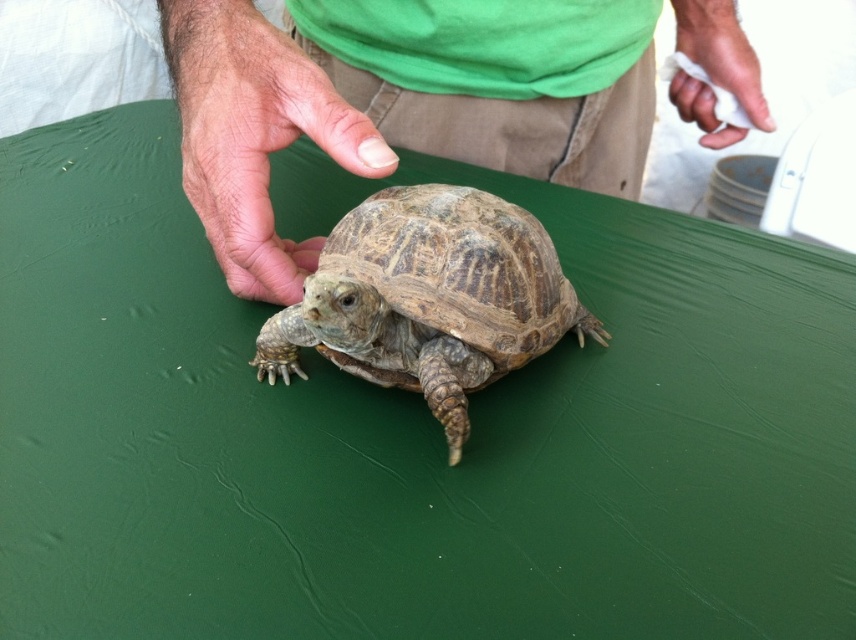
You are a researcher studying the movement patterns of the leathery brown tortoise at center. You need to place a small tracking device on its shell. The device must be placed at the exact coordinates of point [431,298]. Is this point located on the tortoise?

Yes, the point [431,298] is on the leathery brown tortoise at center, so the tracking device can be placed there.

You are a small animal trying to reach the white paper towel at upper right from the fur skin hand at center. Which direction should you move to get there?

The fur skin hand at center is located below the white paper towel at upper right, so you should move upward to reach it.

You are a robotic arm trying to pick up the tortoise. The point at coordinates point (253, 134) is part of the fur skin hand at center. Is this point part of the tortoise or the hand?

The point (253, 134) corresponds to the fur skin hand at center, so it is part of the hand, not the tortoise.